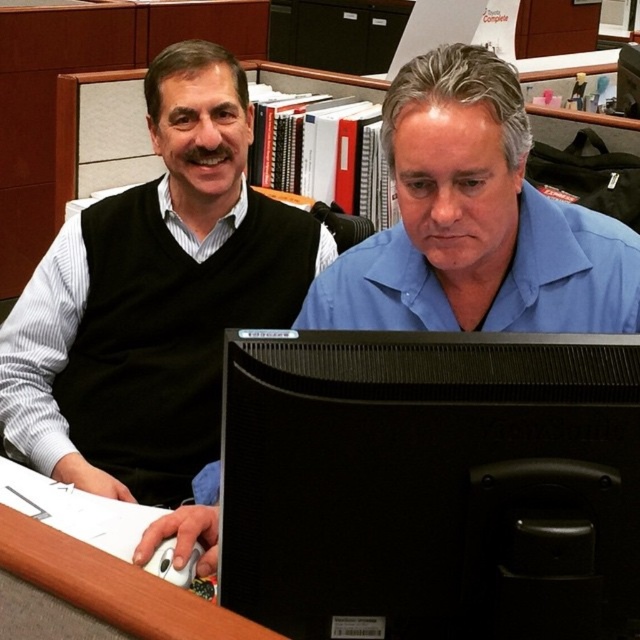
In the scene shown: Is black glossy computer monitor at center wider than blue smooth shirt at center?

In fact, black glossy computer monitor at center might be narrower than blue smooth shirt at center.

You are a GUI agent. You are given a task and a screenshot of the screen. Output one action in this format:
    pyautogui.click(x=<x>, y=<y>)
    Task: Click on the black glossy computer monitor at center
    
    Given the screenshot: What is the action you would take?
    pyautogui.click(x=432, y=484)